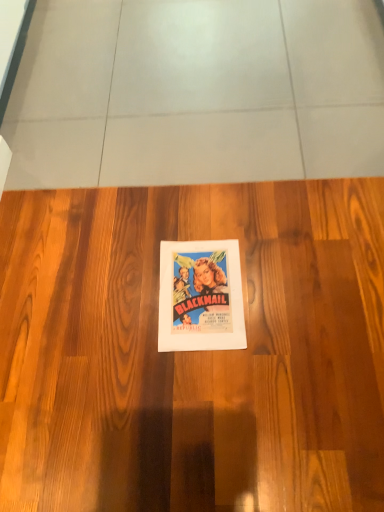
This screenshot has width=384, height=512. Identify the location of free space above vibrant paper poster at center (from a real-world perspective). (203, 286).